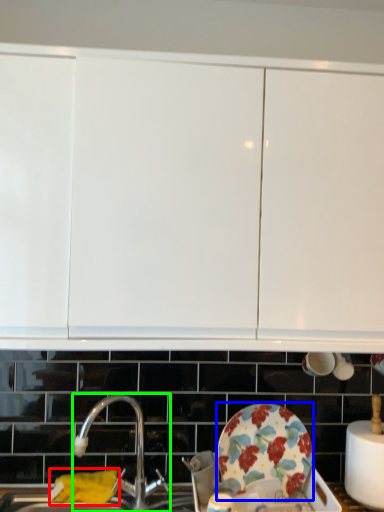
Question: Considering the real-world distances, which object is farthest from material (highlighted by a red box)? plate (highlighted by a blue box) or tap (highlighted by a green box)?

Choices:
 (A) plate
 (B) tap

Answer: (A)